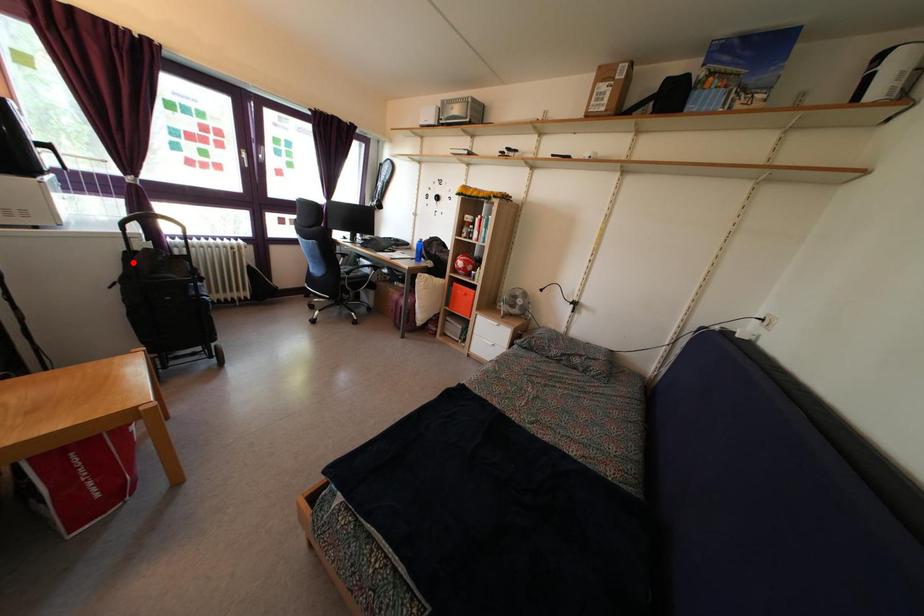
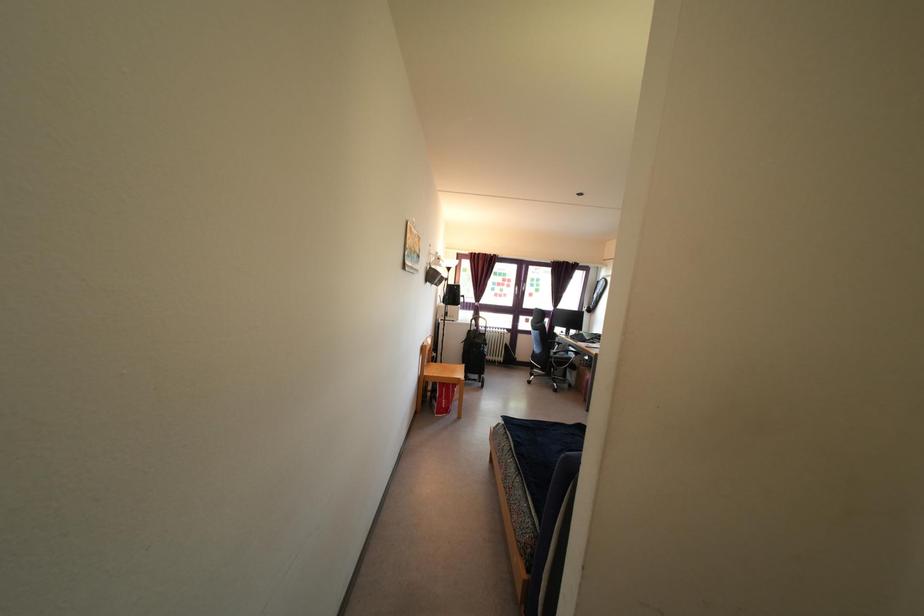
Find the pixel in the second image that matches the highlighted location in the first image.

(472, 339)